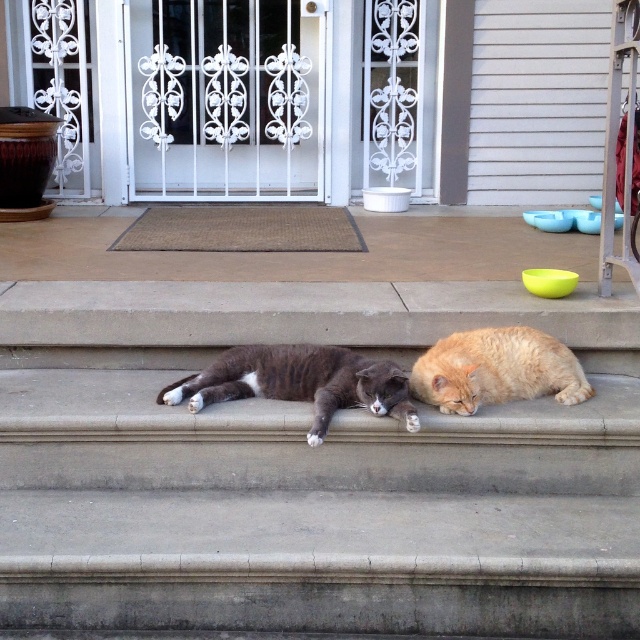
Between concrete stairs at center and orange fluffy cat at lower right, which one appears on the right side from the viewer's perspective?

orange fluffy cat at lower right

Is point (372, 285) closer to camera compared to point (524, 365)?

No.

Between point (136, 285) and point (577, 397), which one is positioned in front?

Point (577, 397) is more forward.

The height and width of the screenshot is (640, 640). I want to click on concrete stairs at center, so click(x=307, y=470).

Can you confirm if gray striped cat at center is wider than orange fluffy cat at lower right?

Yes.

Find the location of a particular element. gray striped cat at center is located at coordinates (300, 381).

This screenshot has width=640, height=640. In order to click on gray striped cat at center in this screenshot , I will do `click(300, 381)`.

Is concrete stairs at center bigger than gray striped cat at center?

Yes.

Describe the element at coordinates (307, 470) in the screenshot. The height and width of the screenshot is (640, 640). I see `concrete stairs at center` at that location.

Measure the distance between point [506,518] and camera.

Point [506,518] and camera are 4.30 meters apart.

This screenshot has height=640, width=640. Identify the location of concrete stairs at center. (307, 470).